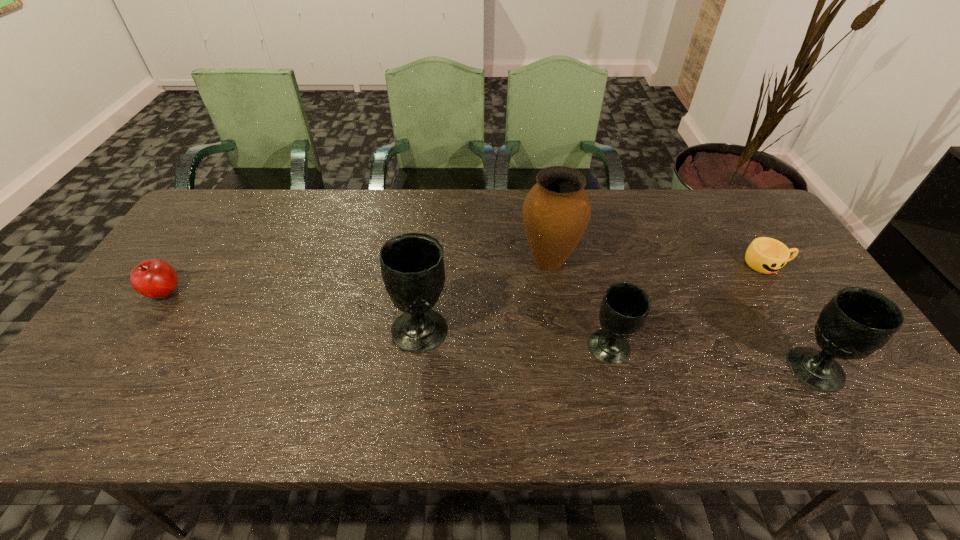
Where is `vacant area that lies between the urn and the third shortest object`? Image resolution: width=960 pixels, height=540 pixels. vacant area that lies between the urn and the third shortest object is located at coordinates (579, 305).

Image resolution: width=960 pixels, height=540 pixels. In order to click on vacant space that is in between the second tallest chalice and the urn in this screenshot , I will do (x=682, y=315).

Identify which object is the fifth nearest to the fifth tallest object. Please provide its 2D coordinates. Your answer should be formatted as a tuple, i.e. [(x, y)], where the tuple contains the x and y coordinates of a point satisfying the conditions above.

[(766, 255)]

Identify which object is the third nearest to the fourth tallest object. Please provide its 2D coordinates. Your answer should be formatted as a tuple, i.e. [(x, y)], where the tuple contains the x and y coordinates of a point satisfying the conditions above.

[(856, 322)]

You are a GUI agent. You are given a task and a screenshot of the screen. Output one action in this format:
    pyautogui.click(x=<x>, y=<y>)
    Task: Click on the chalice object that ranks as the second closest to the urn
    The image size is (960, 540).
    Given the screenshot: What is the action you would take?
    pyautogui.click(x=412, y=264)

Point out which chalice is positioned as the second nearest to the second tallest chalice. Please provide its 2D coordinates. Your answer should be formatted as a tuple, i.e. [(x, y)], where the tuple contains the x and y coordinates of a point satisfying the conditions above.

[(412, 264)]

Locate an element on the screen. vacant space that satisfies the following two spatial constraints: 1. on the front side of the shortest chalice; 2. on the right side of the urn is located at coordinates (563, 348).